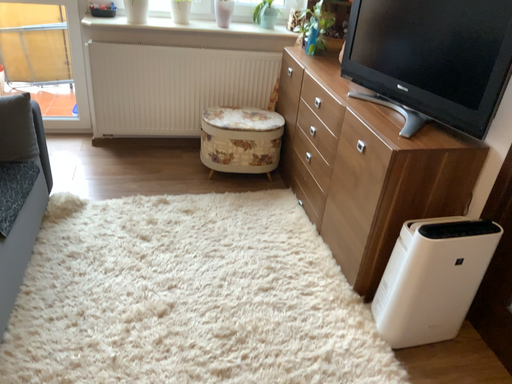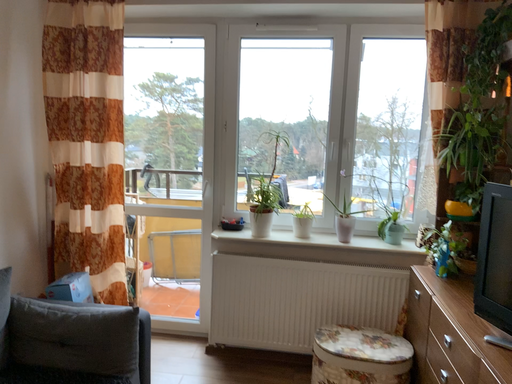
Question: Which way did the camera rotate in the video?

Choices:
 (A) rotated right
 (B) rotated left

Answer: (B)